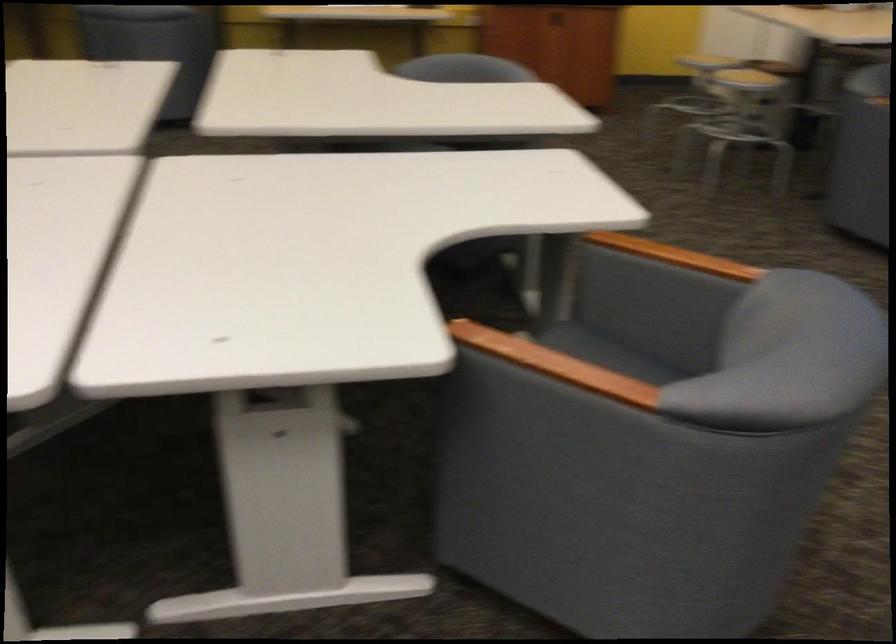
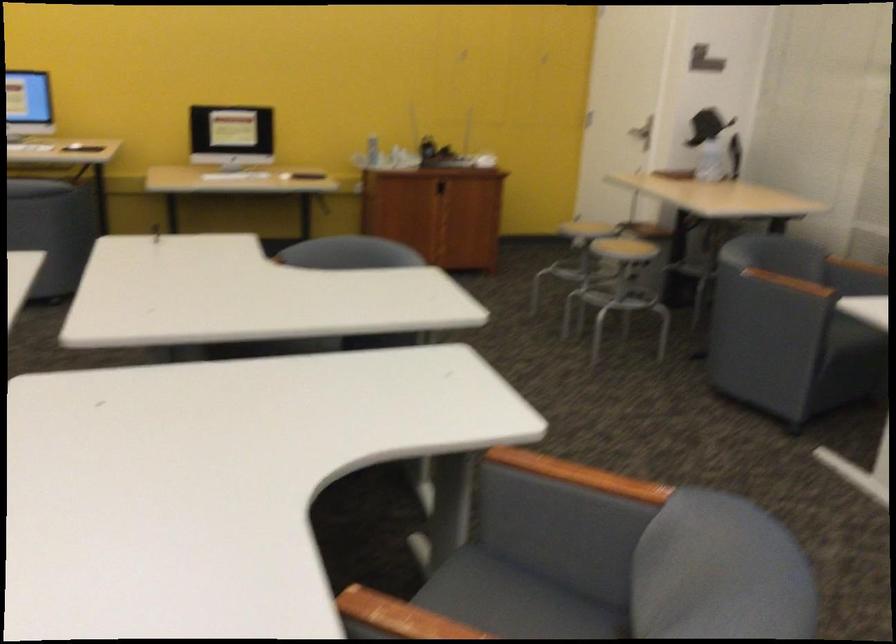
Question: Based on the continuous images, in which direction is the camera rotating? Reply with the corresponding letter.

Choices:
 (A) Left
 (B) Right
 (C) Up
 (D) Down

Answer: (C)